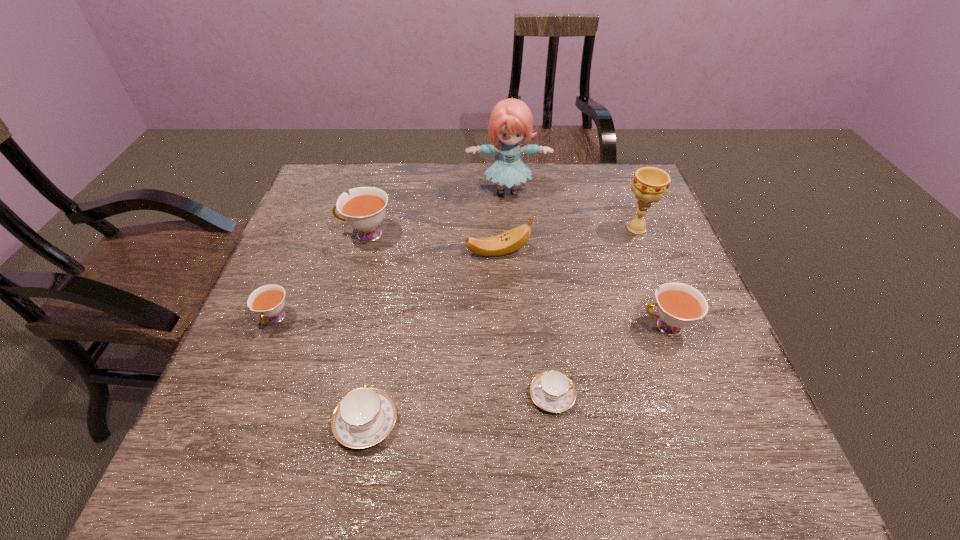
At what (x,y) coordinates should I click in order to perform the action: click on the left blue teacup. Please return your answer as a coordinate pair (x, y). The width and height of the screenshot is (960, 540). Looking at the image, I should click on (365, 416).

The width and height of the screenshot is (960, 540). In order to click on the shortest object in this screenshot , I will do `click(552, 391)`.

The image size is (960, 540). In order to click on the right blue teacup in this screenshot , I will do `click(552, 391)`.

What are the coordinates of `vacant area situated on the front-facing side of the blue doll` in the screenshot? It's located at (514, 275).

Where is `vacant region located on the front of the chalice`? vacant region located on the front of the chalice is located at coordinates (674, 328).

I want to click on vacant position located on the side of the biggest white teacup with the handle, so click(299, 234).

Image resolution: width=960 pixels, height=540 pixels. What are the coordinates of `vacant area situated 0.110m on the side of the biggest white teacup with the handle` in the screenshot? It's located at (299, 234).

At what (x,y) coordinates should I click in order to perform the action: click on vacant space situated 0.060m on the left of the banana. Please return your answer as a coordinate pair (x, y). Looking at the image, I should click on (444, 252).

Locate an element on the screen. blank space located 0.140m on the side of the second tallest teacup with the handle is located at coordinates (576, 327).

In order to click on free space located on the side of the second tallest teacup with the handle in this screenshot , I will do `click(559, 327)`.